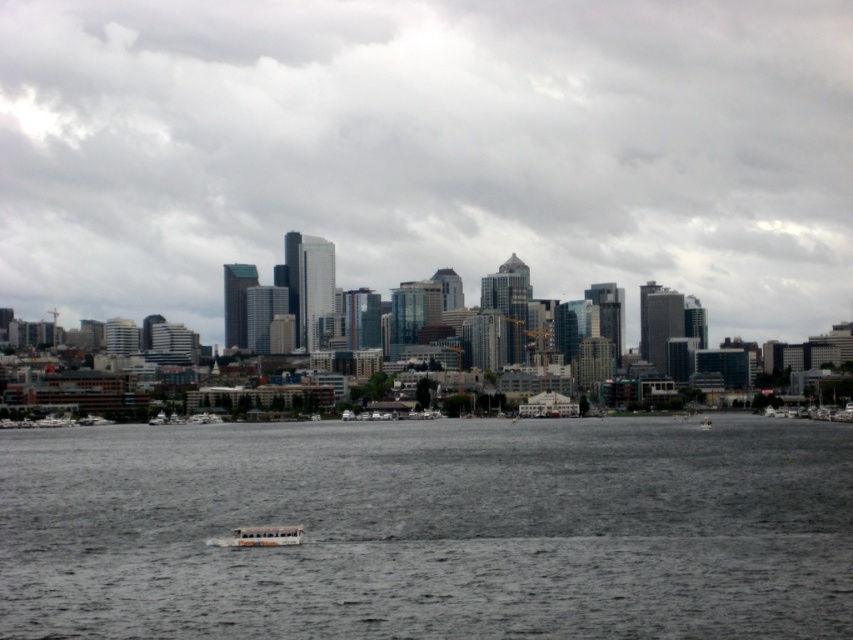
Question: Which point is farther to the camera?

Choices:
 (A) gray water at center
 (B) white plastic boat at lower center
 (C) white plastic boat at center
 (D) transparent glass skyscrapers at center

Answer: (C)

Question: Which point is closer to the camera taking this photo?

Choices:
 (A) (36, 600)
 (B) (703, 268)

Answer: (A)

Question: Where is gray water at center located in relation to white plastic boat at lower center in the image?

Choices:
 (A) below
 (B) above

Answer: (B)

Question: Is transparent glass skyscrapers at center to the right of white plastic boat at center from the viewer's perspective?

Choices:
 (A) yes
 (B) no

Answer: (B)

Question: Considering the relative positions of transparent glass skyscrapers at center and white plastic boat at center in the image provided, where is transparent glass skyscrapers at center located with respect to white plastic boat at center?

Choices:
 (A) below
 (B) above

Answer: (B)

Question: Which point is closer to the camera?

Choices:
 (A) white plastic boat at lower center
 (B) gray water at center
 (C) white plastic boat at center

Answer: (B)